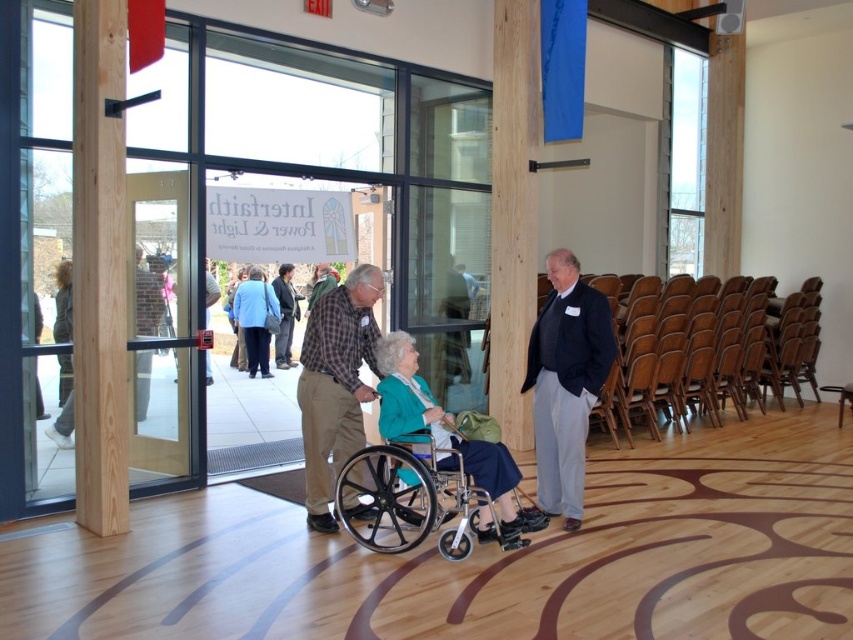
Question: Which point is closer to the camera taking this photo?

Choices:
 (A) (340, 336)
 (B) (554, 339)
 (C) (448, 422)

Answer: (C)

Question: Does wooden pillar at center have a larger size compared to plaid shirt at center?

Choices:
 (A) no
 (B) yes

Answer: (B)

Question: Which object is positioned closest to the matte blue dress at center?

Choices:
 (A) blue fabric coat at center
 (B) dark gray suit at center

Answer: (A)

Question: Where is natural wood pillar at left located in relation to dark gray suit at center in the image?

Choices:
 (A) below
 (B) above

Answer: (B)

Question: Which object is positioned farthest from the dark brown leather jacket at left?

Choices:
 (A) dark gray suit at center
 (B) wooden pillar at center
 (C) blue fabric coat at center
 (D) matte blue dress at center

Answer: (D)

Question: Is the position of silver metallic wheelchair at center more distant than that of blue fabric coat at center?

Choices:
 (A) no
 (B) yes

Answer: (A)